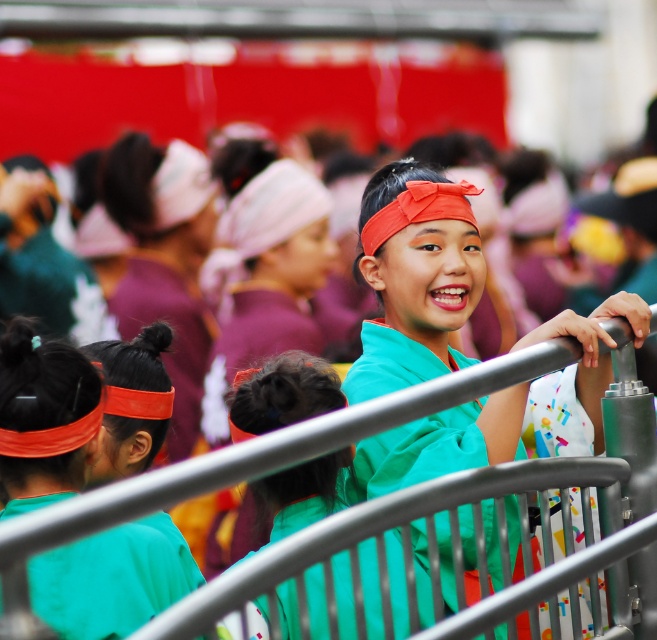
Measure the distance between point (x=407, y=193) and camera.

Point (x=407, y=193) is 27.22 feet away from camera.

Does matte green shirt at center appear on the right side of matte orange headband at left?

Correct, you'll find matte green shirt at center to the right of matte orange headband at left.

Who is more forward, (489, 413) or (7, 426)?

Positioned in front is point (7, 426).

Find the location of `matte green shirt at center`. matte green shirt at center is located at coordinates (415, 276).